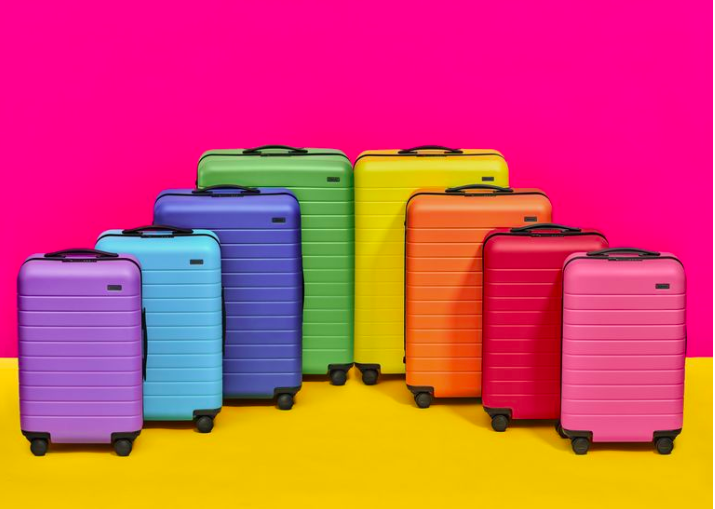
You are a GUI agent. You are given a task and a screenshot of the screen. Output one action in this format:
    pyautogui.click(x=<x>, y=<y>)
    Task: Click on the wheeled suitcases
    
    Given the screenshot: What is the action you would take?
    pyautogui.click(x=78, y=358), pyautogui.click(x=162, y=329), pyautogui.click(x=276, y=282), pyautogui.click(x=330, y=252), pyautogui.click(x=382, y=237), pyautogui.click(x=457, y=262), pyautogui.click(x=523, y=304), pyautogui.click(x=623, y=345)